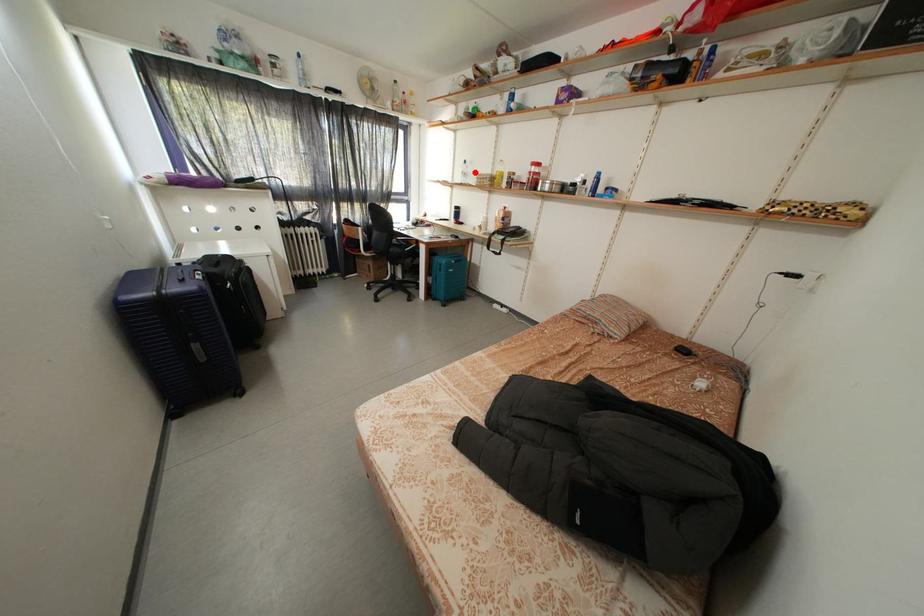
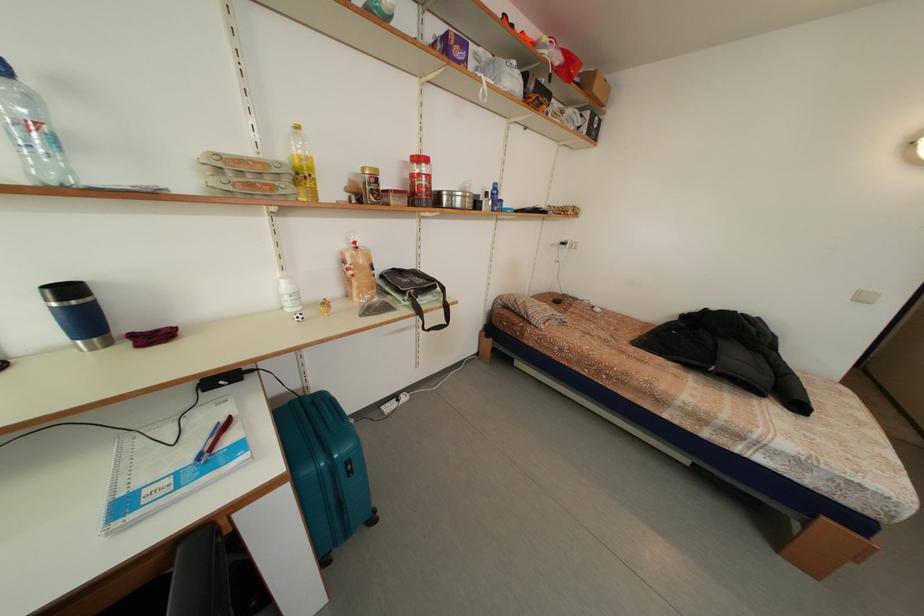
Question: I am providing you with two images of the same scene from different viewpoints. A red point is shown in image1. For the corresponding object point in image2, is it positioned nearer or farther from the camera?

Choices:
 (A) Nearer
 (B) Farther

Answer: (B)